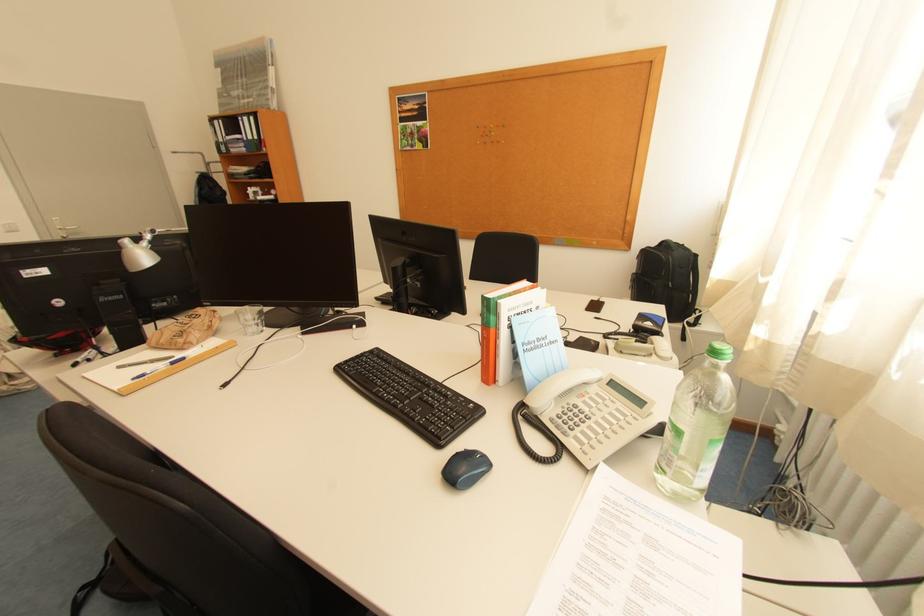
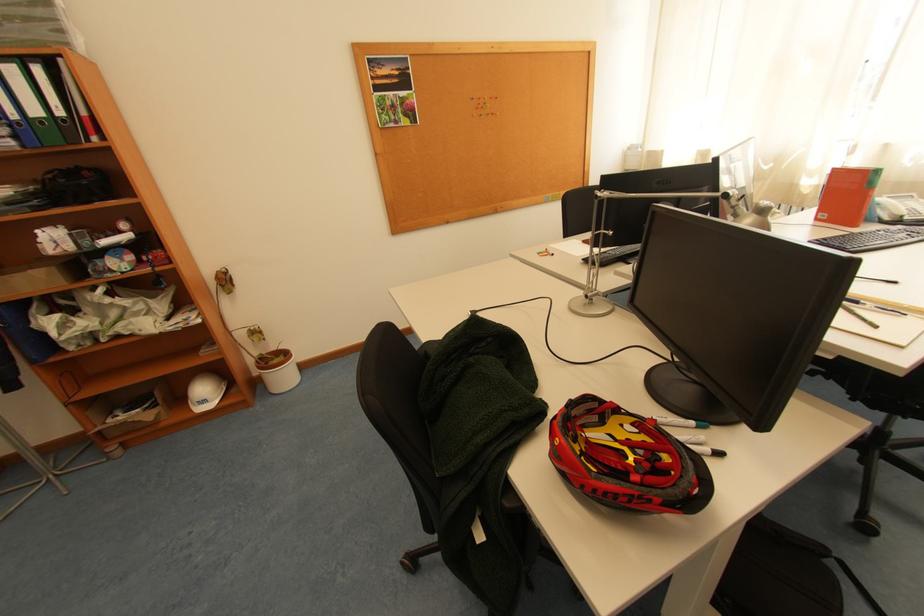
The point at (487, 129) is marked in the first image. Where is the corresponding point in the second image?

(480, 100)